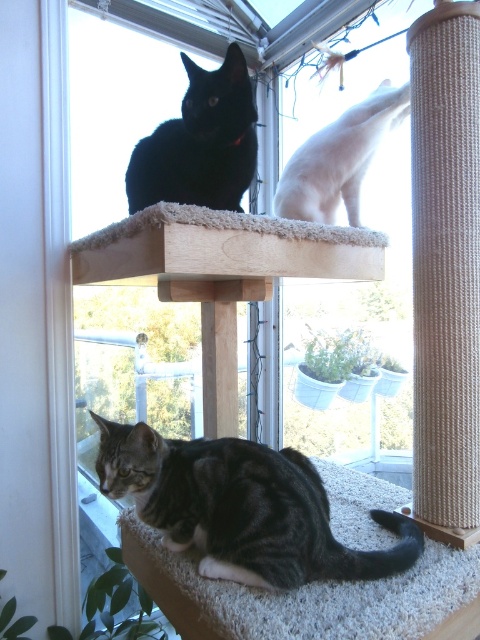
Question: Which object is closer to the camera taking this photo?

Choices:
 (A) white fur cat at upper right
 (B) sisal rope scratching post at right
 (C) tabby fur cat at lower center
 (D) shiny black cat at upper center

Answer: (C)

Question: Is shiny black cat at upper center below white fur cat at upper right?

Choices:
 (A) no
 (B) yes

Answer: (B)

Question: Considering the real-world distances, which object is closest to the sisal rope scratching post at right?

Choices:
 (A) shiny black cat at upper center
 (B) tabby fur cat at lower center
 (C) white fur cat at upper right

Answer: (B)

Question: Can you confirm if tabby fur cat at lower center is positioned to the right of shiny black cat at upper center?

Choices:
 (A) no
 (B) yes

Answer: (B)

Question: Where is sisal rope scratching post at right located in relation to white fur cat at upper right in the image?

Choices:
 (A) above
 (B) below

Answer: (B)

Question: Which point is closer to the camera taking this photo?

Choices:
 (A) (180, 170)
 (B) (354, 124)
 (C) (411, 198)
 (D) (220, 488)

Answer: (D)